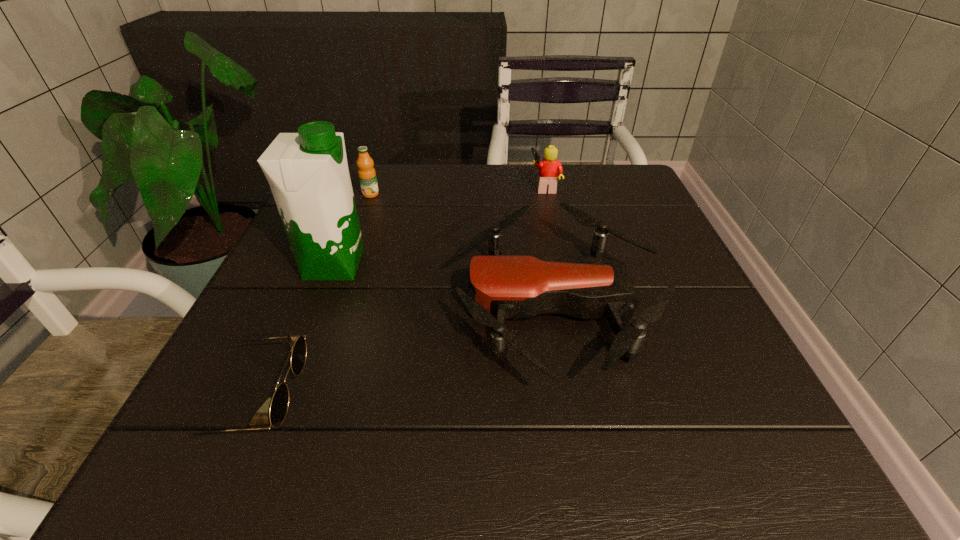
Find the location of a particular element. The image size is (960, 540). blank area located on the front-facing side of the drone is located at coordinates (296, 305).

Identify the location of free region located on the front-facing side of the drone. This screenshot has width=960, height=540. (413, 305).

Identify the location of vacant space located on the front-facing side of the drone. The height and width of the screenshot is (540, 960). (391, 305).

You are a GUI agent. You are given a task and a screenshot of the screen. Output one action in this format:
    pyautogui.click(x=<x>, y=<y>)
    Task: Click on the vacant space located on the front lenses of the sunglasses
    This screenshot has width=960, height=540.
    Given the screenshot: What is the action you would take?
    pyautogui.click(x=334, y=400)

Locate an element on the screen. The width and height of the screenshot is (960, 540). orange juice that is at the far edge is located at coordinates (367, 176).

Where is `Lego located at the far edge`? This screenshot has height=540, width=960. Lego located at the far edge is located at coordinates (549, 168).

At what (x,y) coordinates should I click in order to perform the action: click on object present at the near edge. Please return your answer as a coordinate pair (x, y). The width and height of the screenshot is (960, 540). Looking at the image, I should click on (279, 405).

You are a GUI agent. You are given a task and a screenshot of the screen. Output one action in this format:
    pyautogui.click(x=<x>, y=<y>)
    Task: Click on the soya milk situated at the left edge
    
    Given the screenshot: What is the action you would take?
    pyautogui.click(x=308, y=174)

Identify the location of orange juice located at the left edge. Image resolution: width=960 pixels, height=540 pixels. (367, 176).

The height and width of the screenshot is (540, 960). In order to click on sunglasses situated at the left edge in this screenshot , I will do `click(279, 405)`.